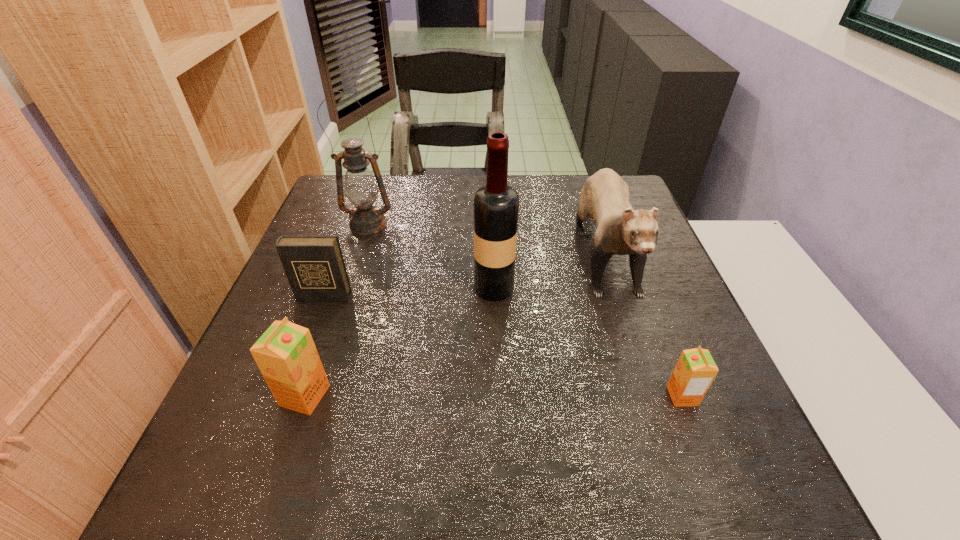
I want to click on object that is positioned at the far left corner, so click(x=361, y=189).

Image resolution: width=960 pixels, height=540 pixels. Find the location of `object that is at the near left corner`. object that is at the near left corner is located at coordinates (286, 355).

I want to click on object present at the far right corner, so click(x=620, y=230).

Find the location of `object at the near right corner`. object at the near right corner is located at coordinates (695, 370).

At what (x,y) coordinates should I click in order to perform the action: click on vacant space at the far edge of the desktop. Please return your answer as a coordinate pair (x, y). The width and height of the screenshot is (960, 540). Looking at the image, I should click on (447, 207).

You are a GUI agent. You are given a task and a screenshot of the screen. Output one action in this format:
    pyautogui.click(x=<x>, y=<y>)
    Task: Click on the vacant space at the near edge
    
    Given the screenshot: What is the action you would take?
    pyautogui.click(x=480, y=404)

You are a GUI agent. You are given a task and a screenshot of the screen. Output one action in this format:
    pyautogui.click(x=<x>, y=<y>)
    Task: Click on the vacant space at the left edge of the desktop
    
    Given the screenshot: What is the action you would take?
    pyautogui.click(x=260, y=334)

Identify the location of free space at the right edge. 660,249.

I want to click on vacant region at the near left corner, so click(x=256, y=417).

Find the location of a particular element. The height and width of the screenshot is (540, 960). vacant space at the near right corner of the desktop is located at coordinates (753, 439).